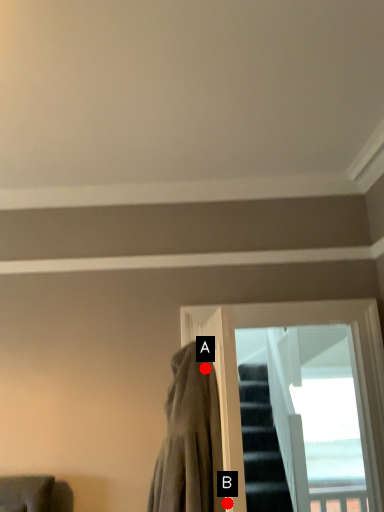
Question: Two points are circled on the image, labeled by A and B beside each circle. Which of the following is the closest to the observer?

Choices:
 (A) A is closer
 (B) B is closer

Answer: (B)